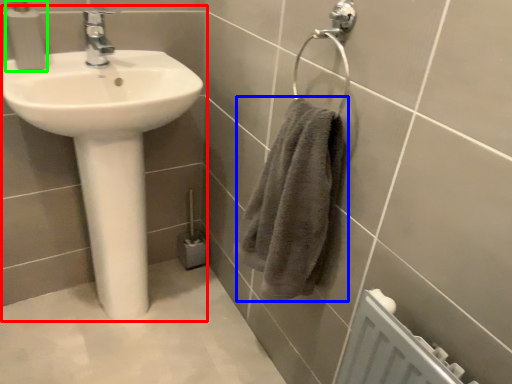
Question: Which object is the farthest from sink (highlighted by a red box)? Choose among these: bath towel (highlighted by a blue box) or soap dispenser (highlighted by a green box).

Choices:
 (A) bath towel
 (B) soap dispenser

Answer: (A)